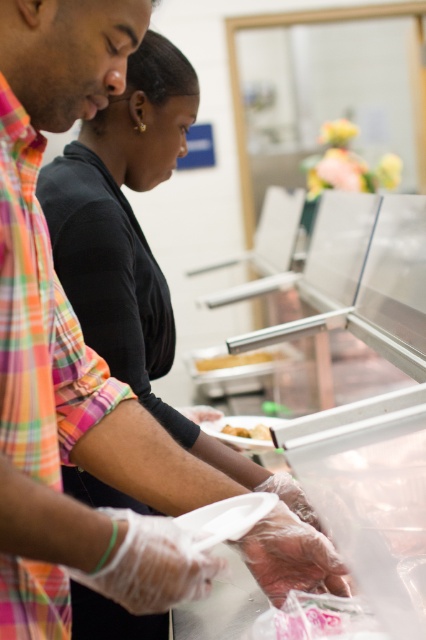
Question: Which point is farther to the camera?

Choices:
 (A) yellow matte bread at center
 (B) yellow matte tray at center

Answer: (B)

Question: Does yellow matte tray at center come behind yellow matte bread at center?

Choices:
 (A) yes
 (B) no

Answer: (A)

Question: Which point is farther from the camera taking this photo?

Choices:
 (A) (253, 353)
 (B) (253, 428)

Answer: (A)

Question: Which object is closer to the camera taking this photo?

Choices:
 (A) yellow matte bread at center
 (B) yellow matte tray at center

Answer: (A)

Question: Does yellow matte tray at center come behind yellow matte bread at center?

Choices:
 (A) yes
 (B) no

Answer: (A)

Question: Does yellow matte tray at center appear under yellow matte bread at center?

Choices:
 (A) yes
 (B) no

Answer: (B)